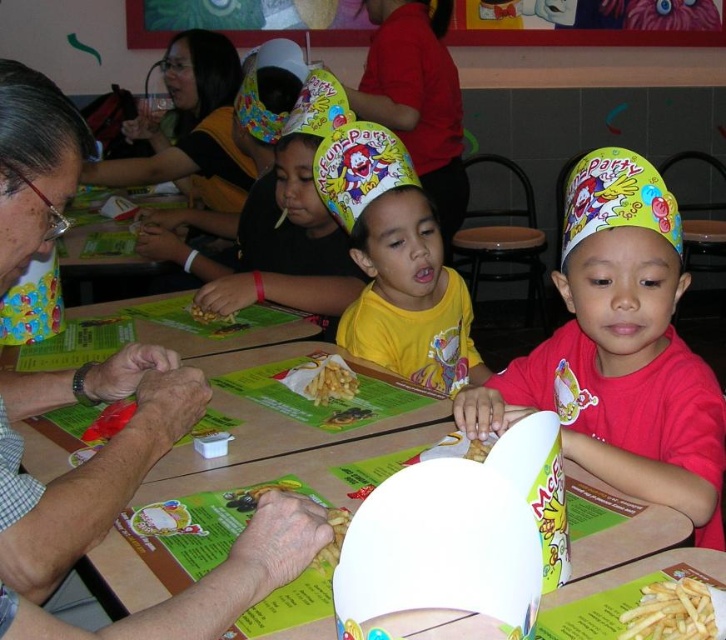
Looking at this image, is matte yellow hat at upper center taller than yellow matte french fries at center?

Correct, matte yellow hat at upper center is much taller as yellow matte french fries at center.

Is the position of matte yellow hat at upper center more distant than that of yellow matte french fries at center?

That is False.

Does point (113, 509) come closer to viewer compared to point (342, 529)?

No.

Locate an element on the screen. matte yellow hat at upper center is located at coordinates click(126, 502).

Does point (584, 458) lie in front of point (380, 145)?

Yes, it is.

What do you see at coordinates (619, 349) in the screenshot?
I see `matte yellow paper hat at center` at bounding box center [619, 349].

This screenshot has height=640, width=726. In order to click on matte yellow paper hat at center in this screenshot , I will do `click(619, 349)`.

Can you confirm if matte yellow hat at upper center is smaller than golden crispy fries at lower right?

Incorrect, matte yellow hat at upper center is not smaller in size than golden crispy fries at lower right.

Which is behind, point (102, 372) or point (677, 612)?

Point (102, 372)

Where is `matte yellow hat at upper center`? Image resolution: width=726 pixels, height=640 pixels. matte yellow hat at upper center is located at coordinates (126, 502).